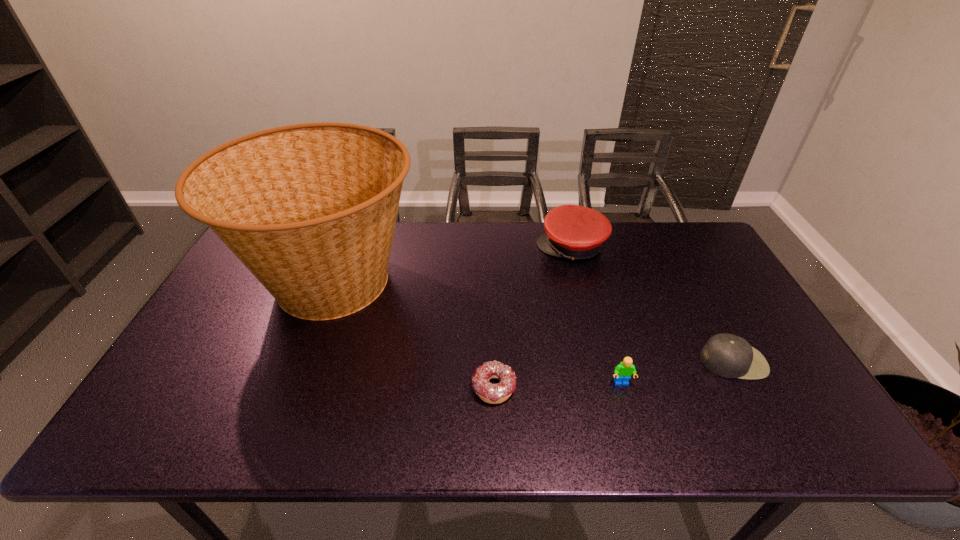
Identify the location of object at the far left corner. The height and width of the screenshot is (540, 960). (310, 209).

The height and width of the screenshot is (540, 960). In the image, there is a desktop. In order to click on free region at the far edge in this screenshot , I will do `click(454, 230)`.

This screenshot has height=540, width=960. Find the location of `vacant region at the near edge of the desktop`. vacant region at the near edge of the desktop is located at coordinates (610, 425).

Identify the location of vacant area at the left edge of the desktop. The image size is (960, 540). (235, 371).

The image size is (960, 540). I want to click on vacant region at the near left corner of the desktop, so click(x=131, y=447).

You are a GUI agent. You are given a task and a screenshot of the screen. Output one action in this format:
    pyautogui.click(x=<x>, y=<y>)
    Task: Click on the vacant space at the near right corner
    The height and width of the screenshot is (540, 960).
    Given the screenshot: What is the action you would take?
    pyautogui.click(x=829, y=433)

Image resolution: width=960 pixels, height=540 pixels. I want to click on free area in between the doughnut and the Lego, so click(x=558, y=385).

Where is `vacant space in between the taller cap and the second shortest object`? vacant space in between the taller cap and the second shortest object is located at coordinates (653, 305).

The height and width of the screenshot is (540, 960). What are the coordinates of `unoccupied area between the second object from left to right and the nearer cap` in the screenshot? It's located at (613, 374).

You are a GUI agent. You are given a task and a screenshot of the screen. Output one action in this format:
    pyautogui.click(x=<x>, y=<y>)
    Task: Click on the free space that is in between the shortest object and the left cap
    Image resolution: width=960 pixels, height=540 pixels.
    Given the screenshot: What is the action you would take?
    pyautogui.click(x=533, y=318)